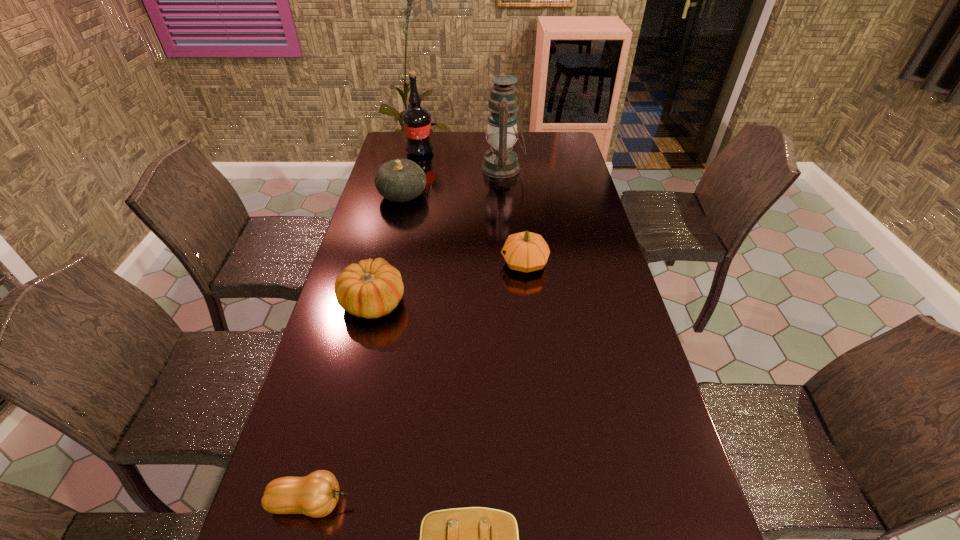
At what (x,y) coordinates should I click in order to perform the action: click on vacant region at the left edge of the desktop. Please return your answer as a coordinate pair (x, y). The width and height of the screenshot is (960, 540). Looking at the image, I should click on (361, 338).

This screenshot has height=540, width=960. What are the coordinates of `vacant region at the right edge` in the screenshot? It's located at (590, 283).

I want to click on free space at the far right corner of the desktop, so (x=545, y=132).

Where is `vacant area between the third farthest gourd and the tallest gourd`? The height and width of the screenshot is (540, 960). vacant area between the third farthest gourd and the tallest gourd is located at coordinates (388, 249).

The height and width of the screenshot is (540, 960). Find the location of `empty space between the farthest gourd and the oil lamp`. empty space between the farthest gourd and the oil lamp is located at coordinates (453, 182).

You are a GUI agent. You are given a task and a screenshot of the screen. Output one action in this format:
    pyautogui.click(x=<x>, y=<y>)
    Task: Click on the object that stands as the fourth closest to the clutch bag
    The image size is (960, 540).
    Given the screenshot: What is the action you would take?
    pyautogui.click(x=400, y=180)

Choose which object is the fifth nearest neighbor to the rightmost gourd. Please provide its 2D coordinates. Your answer should be formatted as a tuple, i.e. [(x, y)], where the tuple contains the x and y coordinates of a point satisfying the conditions above.

[(475, 539)]

Where is `the third closest gourd to the farthest gourd`? The height and width of the screenshot is (540, 960). the third closest gourd to the farthest gourd is located at coordinates (316, 495).

Locate an element on the screen. The height and width of the screenshot is (540, 960). gourd that can be found as the closest to the clutch bag is located at coordinates (316, 495).

You are a GUI agent. You are given a task and a screenshot of the screen. Output one action in this format:
    pyautogui.click(x=<x>, y=<y>)
    Task: Click on the vacant space that satisfies the following two spatial constraints: 1. on the side of the fourth nearest object with the carved face; 2. on the front side of the fifth farthest object
    Image resolution: width=960 pixels, height=540 pixels.
    Given the screenshot: What is the action you would take?
    pyautogui.click(x=529, y=302)